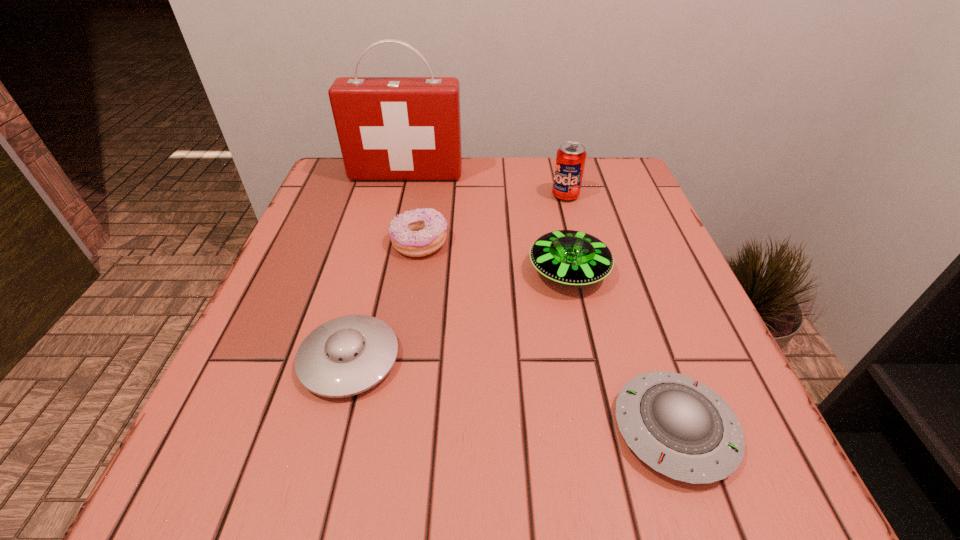
Select which saucer is the closest to the doughnut. Please provide its 2D coordinates. Your answer should be formatted as a tuple, i.e. [(x, y)], where the tuple contains the x and y coordinates of a point satisfying the conditions above.

[(569, 257)]

The image size is (960, 540). In order to click on free location that satisfies the following two spatial constraints: 1. on the front face of the fifth nearest object; 2. on the left side of the farthest object in this screenshot , I will do `click(401, 195)`.

The width and height of the screenshot is (960, 540). Identify the location of vacant position in the image that satisfies the following two spatial constraints: 1. on the front face of the fifth nearest object; 2. on the left side of the tallest object. (401, 195).

The width and height of the screenshot is (960, 540). I want to click on free space in the image that satisfies the following two spatial constraints: 1. on the back side of the doughnut; 2. on the left side of the leftmost saucer, so click(380, 243).

Identify the location of vacant region that satisfies the following two spatial constraints: 1. on the front face of the first-aid kit; 2. on the left side of the doughnut. (390, 243).

At what (x,y) coordinates should I click in order to perform the action: click on vacant position in the image that satisfies the following two spatial constraints: 1. on the front face of the tallest object; 2. on the right side of the farthest saucer. Please return your answer as a coordinate pair (x, y). Image resolution: width=960 pixels, height=540 pixels. Looking at the image, I should click on (383, 272).

In order to click on vacant area in the image that satisfies the following two spatial constraints: 1. on the front face of the soda can; 2. on the right side of the first-aid kit in this screenshot , I will do `click(401, 195)`.